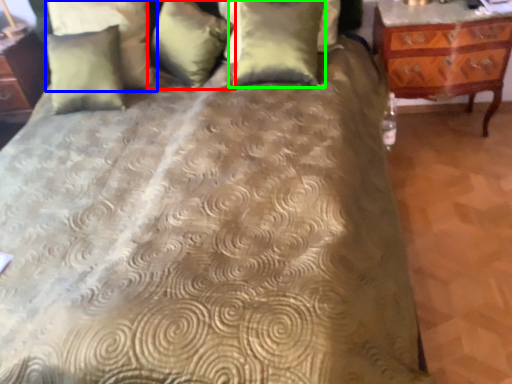
Question: Estimate the real-world distances between objects in this image. Which object is farther from pillow (highlighted by a red box), pillow (highlighted by a blue box) or pillow (highlighted by a green box)?

Choices:
 (A) pillow
 (B) pillow

Answer: (B)